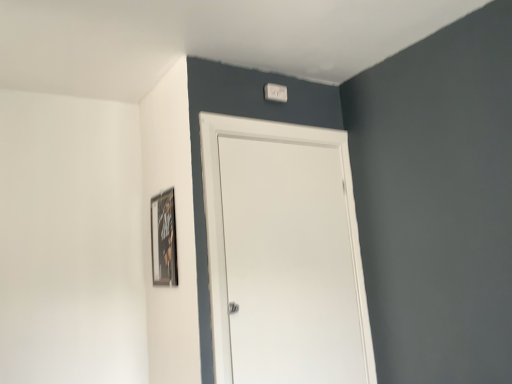
Question: Should I look upward or downward to see wooden framed poster at upper left?

Choices:
 (A) up
 (B) down

Answer: (B)

Question: From a real-world perspective, is wooden framed poster at upper left physically below white matte door at center?

Choices:
 (A) yes
 (B) no

Answer: (B)

Question: Is wooden framed poster at upper left at the right side of white matte door at center?

Choices:
 (A) no
 (B) yes

Answer: (A)

Question: Are wooden framed poster at upper left and white matte door at center far apart?

Choices:
 (A) no
 (B) yes

Answer: (A)

Question: Is wooden framed poster at upper left oriented towards white matte door at center?

Choices:
 (A) yes
 (B) no

Answer: (B)

Question: Does wooden framed poster at upper left have a larger size compared to white matte door at center?

Choices:
 (A) no
 (B) yes

Answer: (A)

Question: Is wooden framed poster at upper left thinner than white matte door at center?

Choices:
 (A) no
 (B) yes

Answer: (B)

Question: Does wooden framed poster at upper left have a smaller size compared to white plastic light switch at upper center?

Choices:
 (A) yes
 (B) no

Answer: (B)

Question: From a real-world perspective, is wooden framed poster at upper left physically above white plastic light switch at upper center?

Choices:
 (A) no
 (B) yes

Answer: (A)

Question: Could you tell me if wooden framed poster at upper left is facing white plastic light switch at upper center?

Choices:
 (A) yes
 (B) no

Answer: (B)

Question: From a real-world perspective, is wooden framed poster at upper left beneath white plastic light switch at upper center?

Choices:
 (A) yes
 (B) no

Answer: (A)

Question: Is wooden framed poster at upper left shorter than white plastic light switch at upper center?

Choices:
 (A) no
 (B) yes

Answer: (A)

Question: Can you confirm if wooden framed poster at upper left is positioned to the left of white plastic light switch at upper center?

Choices:
 (A) no
 (B) yes

Answer: (B)

Question: Is white matte door at center bigger than white plastic light switch at upper center?

Choices:
 (A) no
 (B) yes

Answer: (B)